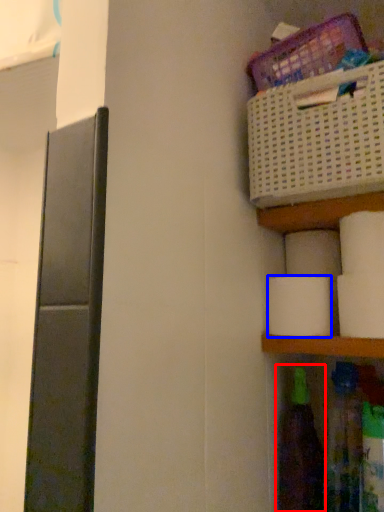
Question: Which point is closer to the camera, bottle (highlighted by a red box) or toilet paper (highlighted by a blue box)?

Choices:
 (A) bottle
 (B) toilet paper

Answer: (B)